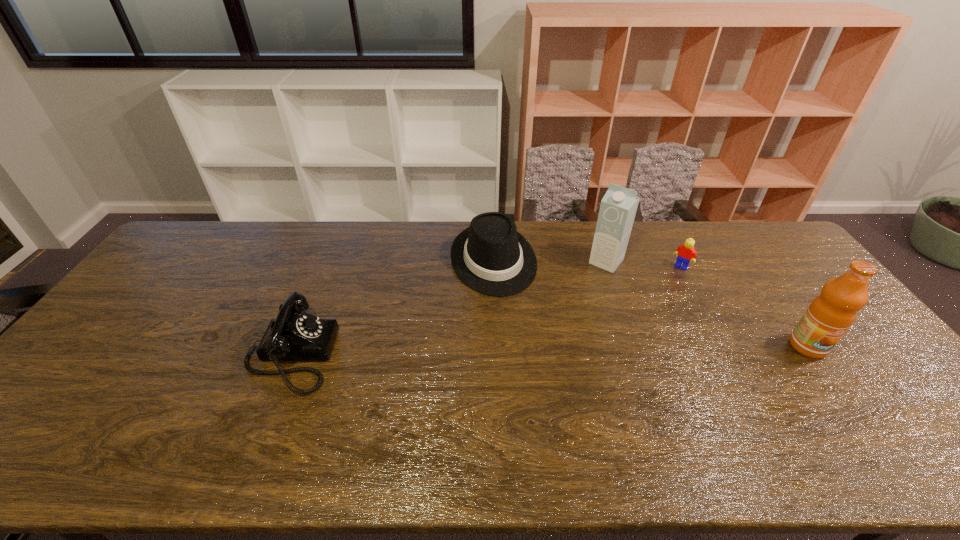
Identify the location of vacant area that lies between the shortest object and the fedora. (588, 263).

The width and height of the screenshot is (960, 540). Identify the location of free area in between the shortest object and the third object from left to right. (643, 264).

This screenshot has height=540, width=960. In order to click on free space between the fruit juice and the carton in this screenshot , I will do `click(707, 304)`.

This screenshot has height=540, width=960. Find the location of `empty location between the leftmost object and the fourth object from right to left`. empty location between the leftmost object and the fourth object from right to left is located at coordinates (392, 307).

At what (x,y) coordinates should I click in order to perform the action: click on free spot between the fruit juice and the carton. Please return your answer as a coordinate pair (x, y). Looking at the image, I should click on (707, 304).

The height and width of the screenshot is (540, 960). In order to click on vacant space that is in between the fruit juice and the second object from left to right in this screenshot , I will do (651, 303).

The image size is (960, 540). In order to click on empty space between the second object from right to left and the rightmost object in this screenshot , I will do `click(744, 306)`.

Locate an element on the screen. The height and width of the screenshot is (540, 960). the fourth closest object relative to the telephone is located at coordinates (828, 317).

Identify which object is the second closest to the Lego. Please provide its 2D coordinates. Your answer should be formatted as a tuple, i.e. [(x, y)], where the tuple contains the x and y coordinates of a point satisfying the conditions above.

[(828, 317)]

Identify the location of vacant space that satisfies the following two spatial constraints: 1. on the front side of the fedora; 2. on the left side of the third object from right to left. (493, 262).